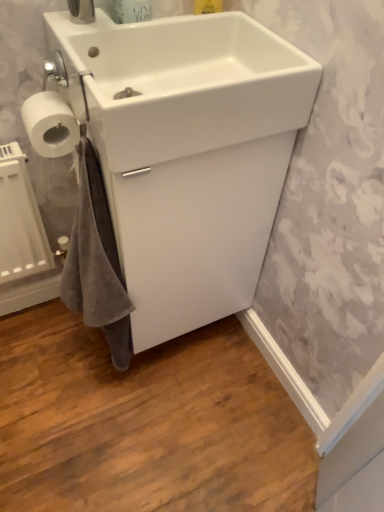
Question: Considering the positions of white glossy sink at upper center, the 1th sink viewed from the front, and white glossy sink at center, the 1th sink when ordered from back to front, in the image, is white glossy sink at upper center, the 1th sink viewed from the front, taller or shorter than white glossy sink at center, the 1th sink when ordered from back to front,?

Choices:
 (A) short
 (B) tall

Answer: (A)

Question: Considering the positions of white glossy sink at upper center, the 2th sink in the back-to-front sequence, and white glossy sink at center, the 1th sink when ordered from back to front, in the image, is white glossy sink at upper center, the 2th sink in the back-to-front sequence, bigger or smaller than white glossy sink at center, the 1th sink when ordered from back to front,?

Choices:
 (A) big
 (B) small

Answer: (B)

Question: Considering the real-world distances, which object is closest to the white glossy sink at center, the 1th sink when ordered from back to front?

Choices:
 (A) white glossy sink at upper center, the 2th sink in the back-to-front sequence
 (B) white matte toilet paper at left

Answer: (A)

Question: Which object is the closest to the white glossy sink at upper center, the 2th sink in the back-to-front sequence?

Choices:
 (A) white glossy sink at center, the 1th sink when ordered from back to front
 (B) white matte toilet paper at left

Answer: (A)